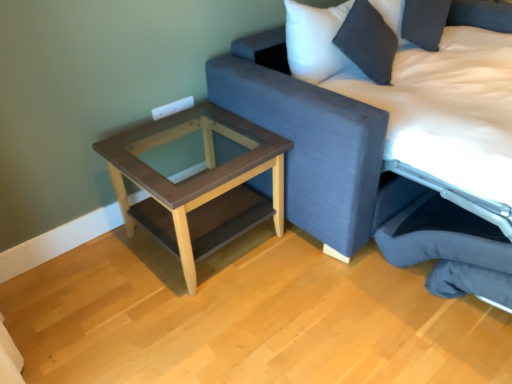
Identify the location of textured fabric studio couch at upper right. (357, 175).

I want to click on textured fabric studio couch at upper right, so click(x=357, y=175).

Considering the relative sizes of brown wood table at lower left and dark gray fabric swivel chair at lower right in the image provided, is brown wood table at lower left smaller than dark gray fabric swivel chair at lower right?

Incorrect, brown wood table at lower left is not smaller in size than dark gray fabric swivel chair at lower right.

Are brown wood table at lower left and dark gray fabric swivel chair at lower right far apart?

No, there isn't a large distance between brown wood table at lower left and dark gray fabric swivel chair at lower right.

Find the location of `swivel chair in front of the brown wood table at lower left`. swivel chair in front of the brown wood table at lower left is located at coordinates (450, 249).

How far apart are brown wood table at lower left and dark gray fabric swivel chair at lower right?

The distance of brown wood table at lower left from dark gray fabric swivel chair at lower right is 30.77 inches.

Identify the location of table above the dark gray fabric swivel chair at lower right (from the image's perspective). The height and width of the screenshot is (384, 512). (198, 183).

Would you say dark gray fabric swivel chair at lower right is inside or outside brown wood table at lower left?

dark gray fabric swivel chair at lower right is spatially situated outside brown wood table at lower left.

Is dark gray fabric swivel chair at lower right further to camera compared to brown wood table at lower left?

No, the depth of dark gray fabric swivel chair at lower right is less than that of brown wood table at lower left.

Is dark gray fabric swivel chair at lower right at the left side of brown wood table at lower left?

Incorrect, dark gray fabric swivel chair at lower right is not on the left side of brown wood table at lower left.

Between textured fabric studio couch at upper right and brown wood table at lower left, which one has larger size?

Bigger between the two is textured fabric studio couch at upper right.

Choose the correct answer: Is textured fabric studio couch at upper right inside brown wood table at lower left or outside it?

textured fabric studio couch at upper right lies outside brown wood table at lower left.

Looking at this image, which object is closer to the camera, textured fabric studio couch at upper right or brown wood table at lower left?

textured fabric studio couch at upper right.

The height and width of the screenshot is (384, 512). I want to click on studio couch on the right of brown wood table at lower left, so click(x=357, y=175).

Who is smaller, brown wood table at lower left or textured fabric studio couch at upper right?

With smaller size is brown wood table at lower left.

From a real-world perspective, which is physically above, brown wood table at lower left or textured fabric studio couch at upper right?

From a 3D spatial view, textured fabric studio couch at upper right is above.

Which is more to the right, brown wood table at lower left or textured fabric studio couch at upper right?

Positioned to the right is textured fabric studio couch at upper right.

Is dark gray fabric swivel chair at lower right to the left of textured fabric studio couch at upper right from the viewer's perspective?

Indeed, dark gray fabric swivel chair at lower right is positioned on the left side of textured fabric studio couch at upper right.

From a real-world perspective, between dark gray fabric swivel chair at lower right and textured fabric studio couch at upper right, who is vertically lower?

From a 3D spatial view, dark gray fabric swivel chair at lower right is below.

Can we say dark gray fabric swivel chair at lower right lies outside textured fabric studio couch at upper right?

No, dark gray fabric swivel chair at lower right is not entirely external to textured fabric studio couch at upper right.

Is textured fabric studio couch at upper right positioned behind dark gray fabric swivel chair at lower right?

No, textured fabric studio couch at upper right is closer to the viewer.

Is textured fabric studio couch at upper right at the left side of dark gray fabric swivel chair at lower right?

No.

What's the angular difference between textured fabric studio couch at upper right and dark gray fabric swivel chair at lower right's facing directions?

textured fabric studio couch at upper right and dark gray fabric swivel chair at lower right are facing 0.924 degrees away from each other.

Is textured fabric studio couch at upper right placed right next to dark gray fabric swivel chair at lower right?

textured fabric studio couch at upper right and dark gray fabric swivel chair at lower right are not in contact.

What are the coordinates of `swivel chair to the right of brown wood table at lower left` in the screenshot? It's located at (450, 249).

Find the location of a particular element. Image resolution: width=512 pixels, height=384 pixels. swivel chair that appears in front of the brown wood table at lower left is located at coordinates (450, 249).

From the image, which object appears to be nearer to dark gray fabric swivel chair at lower right, textured fabric studio couch at upper right or brown wood table at lower left?

textured fabric studio couch at upper right is closer to dark gray fabric swivel chair at lower right.

Based on their spatial positions, is brown wood table at lower left or dark gray fabric swivel chair at lower right closer to textured fabric studio couch at upper right?

The object closer to textured fabric studio couch at upper right is dark gray fabric swivel chair at lower right.

From the image, which object appears to be farther from dark gray fabric swivel chair at lower right, brown wood table at lower left or textured fabric studio couch at upper right?

brown wood table at lower left is positioned further to the anchor dark gray fabric swivel chair at lower right.

Looking at the image, which one is located closer to textured fabric studio couch at upper right, dark gray fabric swivel chair at lower right or brown wood table at lower left?

The object closer to textured fabric studio couch at upper right is dark gray fabric swivel chair at lower right.

Looking at the image, which one is located closer to brown wood table at lower left, dark gray fabric swivel chair at lower right or textured fabric studio couch at upper right?

Based on the image, textured fabric studio couch at upper right appears to be nearer to brown wood table at lower left.

Looking at the image, which one is located closer to brown wood table at lower left, textured fabric studio couch at upper right or dark gray fabric swivel chair at lower right?

Among the two, textured fabric studio couch at upper right is located nearer to brown wood table at lower left.

The width and height of the screenshot is (512, 384). Identify the location of swivel chair located between brown wood table at lower left and textured fabric studio couch at upper right in the left-right direction. (450, 249).